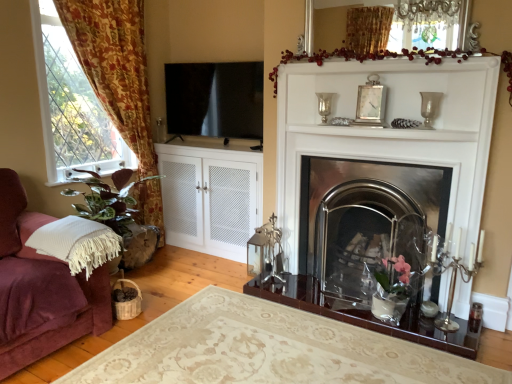
Question: Is transparent glass window screen at upper left looking in the opposite direction of polished stainless steel fireplace at center?

Choices:
 (A) yes
 (B) no

Answer: (B)

Question: Can you confirm if transparent glass window screen at upper left is bigger than polished stainless steel fireplace at center?

Choices:
 (A) no
 (B) yes

Answer: (A)

Question: Is transparent glass window screen at upper left surrounding polished stainless steel fireplace at center?

Choices:
 (A) yes
 (B) no

Answer: (B)

Question: Would you say transparent glass window screen at upper left is a long distance from polished stainless steel fireplace at center?

Choices:
 (A) no
 (B) yes

Answer: (B)

Question: Does transparent glass window screen at upper left have a lesser height compared to polished stainless steel fireplace at center?

Choices:
 (A) yes
 (B) no

Answer: (A)

Question: Considering the relative sizes of transparent glass window screen at upper left and polished stainless steel fireplace at center in the image provided, is transparent glass window screen at upper left wider than polished stainless steel fireplace at center?

Choices:
 (A) no
 (B) yes

Answer: (A)

Question: Could you tell me if silver metallic clock at upper center is facing green leafy plant at left, arranged as the second plant when viewed from the top?

Choices:
 (A) yes
 (B) no

Answer: (B)

Question: Can you confirm if silver metallic clock at upper center is taller than green leafy plant at left, positioned as the 1th plant in bottom-to-top order?

Choices:
 (A) no
 (B) yes

Answer: (A)

Question: Is silver metallic clock at upper center positioned with its back to green leafy plant at left, arranged as the second plant when viewed from the top?

Choices:
 (A) no
 (B) yes

Answer: (A)

Question: From the image's perspective, is silver metallic clock at upper center over green leafy plant at left, positioned as the 1th plant in bottom-to-top order?

Choices:
 (A) yes
 (B) no

Answer: (A)

Question: From a real-world perspective, is silver metallic clock at upper center over green leafy plant at left, marked as the 2th plant in a right-to-left arrangement?

Choices:
 (A) yes
 (B) no

Answer: (A)

Question: Does silver metallic clock at upper center appear on the right side of green leafy plant at left, positioned as the 1th plant in bottom-to-top order?

Choices:
 (A) yes
 (B) no

Answer: (A)

Question: Does polished stainless steel fireplace at center have a greater height compared to clear glass vase at upper center, which is the first candle holder in left-to-right order?

Choices:
 (A) no
 (B) yes

Answer: (B)